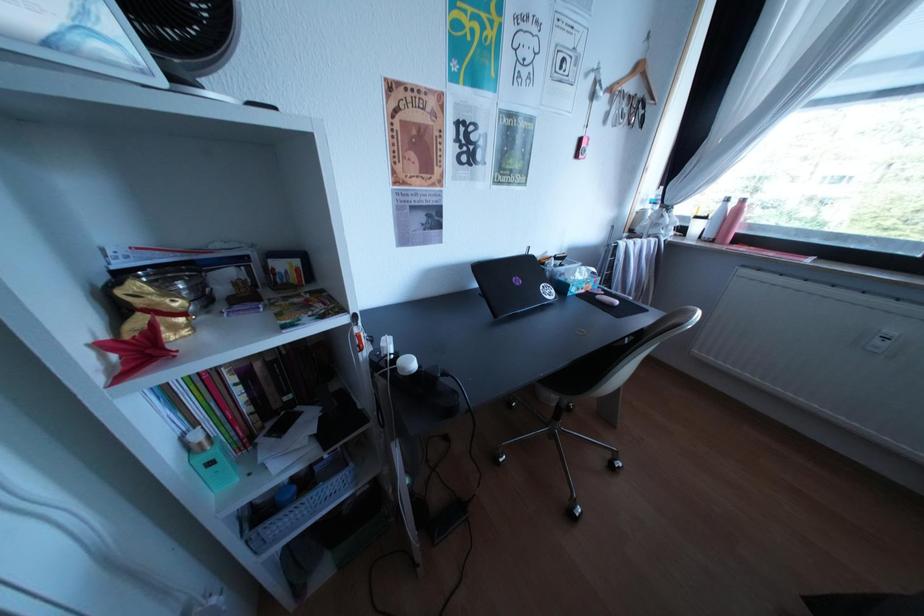
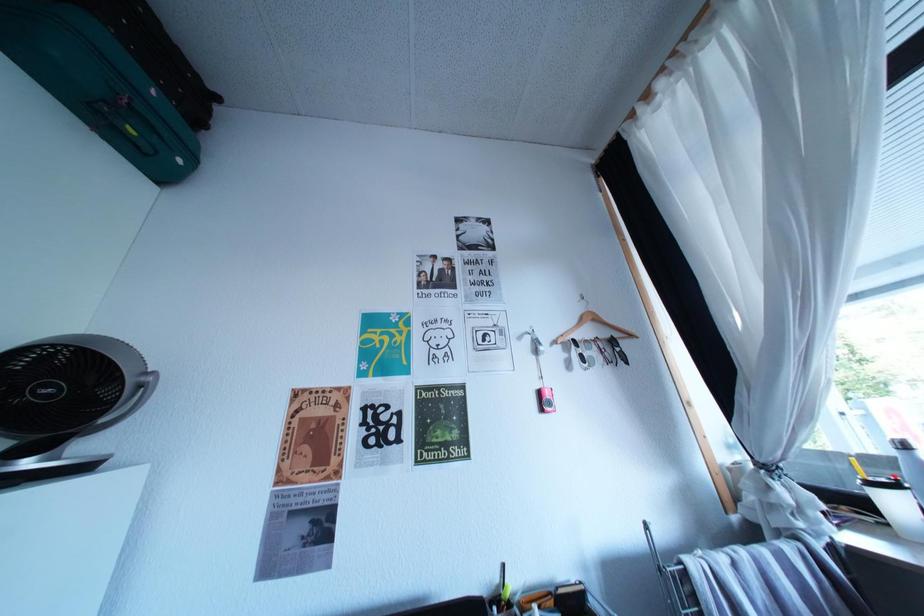
Based on the continuous images, in which direction is the camera rotating?

The camera's rotation is toward left-up.